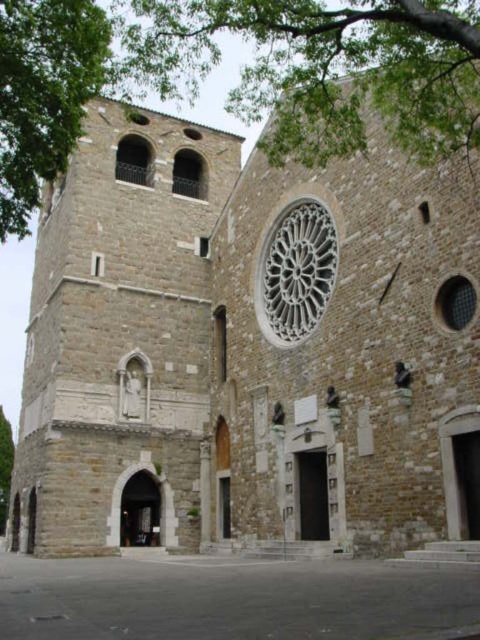
Is point (308, 317) positioned in front of point (9, 458)?

Yes, it is.

Between point (305, 227) and point (10, 426), which one is positioned in front?

Point (305, 227)

Where is `white stone rose window at center`? white stone rose window at center is located at coordinates (296, 272).

Who is shorter, green leafy tree at upper center or green leafy tree at upper left?

With less height is green leafy tree at upper left.

Image resolution: width=480 pixels, height=640 pixels. What are the coordinates of `green leafy tree at upper center` in the screenshot? It's located at (321, 67).

Which of these two, green leafy tree at upper center or green leafy tree at left, stands taller?

Standing taller between the two is green leafy tree at upper center.

Who is positioned more to the left, green leafy tree at upper center or green leafy tree at left?

green leafy tree at left

Does point (347, 24) come closer to viewer compared to point (1, 449)?

Yes, it is.

The height and width of the screenshot is (640, 480). What are the coordinates of `green leafy tree at upper center` in the screenshot? It's located at (321, 67).